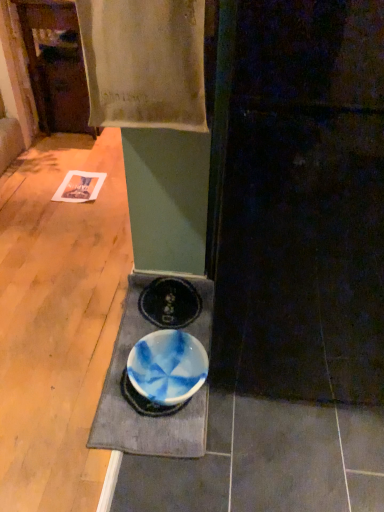
Question: Is point (152, 18) closer or farther from the camera than point (286, 74)?

Choices:
 (A) closer
 (B) farther

Answer: (B)

Question: Based on their sizes in the image, would you say white cotton towel at upper center is bigger or smaller than smooth dark wood door at center?

Choices:
 (A) small
 (B) big

Answer: (A)

Question: Estimate the real-world distances between objects in this image. Which object is farther from the blue glazed bowl at lower center?

Choices:
 (A) white cotton towel at upper center
 (B) smooth dark wood door at center
 (C) blue glossy bowl at center

Answer: (A)

Question: Estimate the real-world distances between objects in this image. Which object is closer to the blue glossy bowl at center?

Choices:
 (A) blue glazed bowl at lower center
 (B) smooth dark wood door at center
 (C) white cotton towel at upper center

Answer: (A)